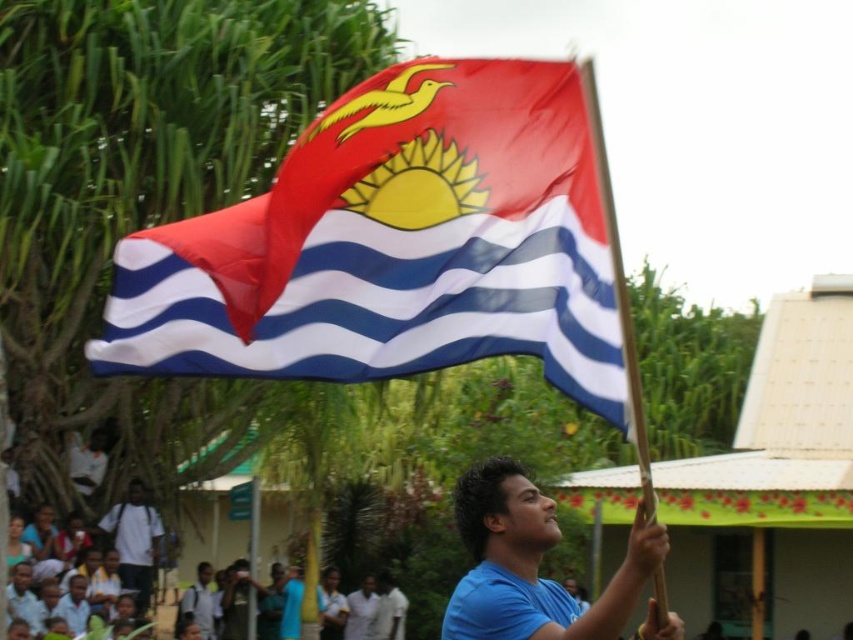
Question: Based on their relative distances, which object is nearer to the silky fabric flag at center?

Choices:
 (A) blue matte shirt at center
 (B) white cotton shirt at lower left

Answer: (A)

Question: Considering the real-world distances, which object is closest to the silky fabric flag at center?

Choices:
 (A) white cotton shirt at lower left
 (B) blue matte shirt at center

Answer: (B)

Question: Can you confirm if blue matte shirt at center is positioned to the right of white cotton shirt at lower left?

Choices:
 (A) yes
 (B) no

Answer: (A)

Question: Is blue matte shirt at center positioned at the back of white cotton shirt at lower left?

Choices:
 (A) no
 (B) yes

Answer: (A)

Question: From the image, what is the correct spatial relationship of blue matte shirt at center in relation to white cotton shirt at lower left?

Choices:
 (A) above
 (B) below

Answer: (A)

Question: Which of the following is the farthest from the observer?

Choices:
 (A) (131, 532)
 (B) (582, 637)

Answer: (A)